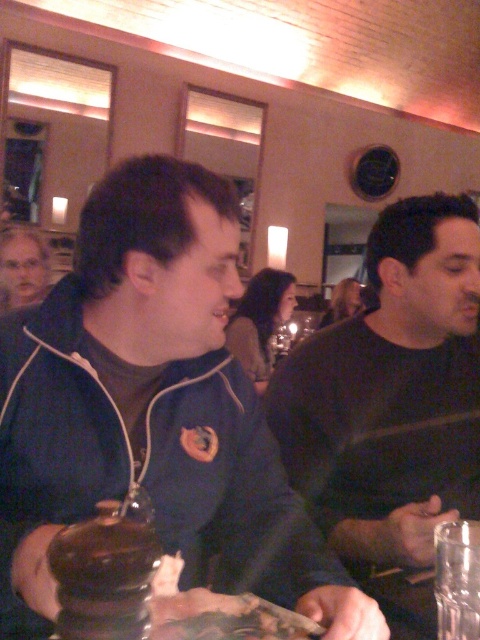
You are a guest at this restaurant and want to greet the person with gray hair at upper left. Which direction should you walk from the dark gray shirt at center to reach them?

The dark gray shirt at center is located below the gray hair at upper left, so you should walk upwards or towards the upper part of the scene to reach the gray hair at upper left.

You are standing in the restaurant and want to locate the blue fleece jacket at center. According to the coordinates provided, where would you look to find it?

The blue fleece jacket at center is located at coordinates point (152,406).

You are standing at the entrance of the restaurant and see two points marked in the scene. Which point is closer to you, point (0, 410) or point (431, 272)?

Point (0, 410) is in front of point (431, 272), so it is closer to you.